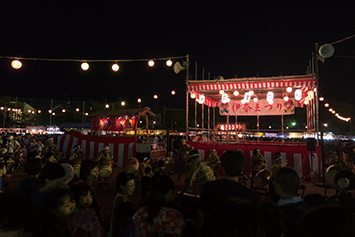
At what (x,y) coordinates should I click in order to perform the action: click on light. Please return your answer as a coordinate pair (x, y). Looking at the image, I should click on (153, 61).